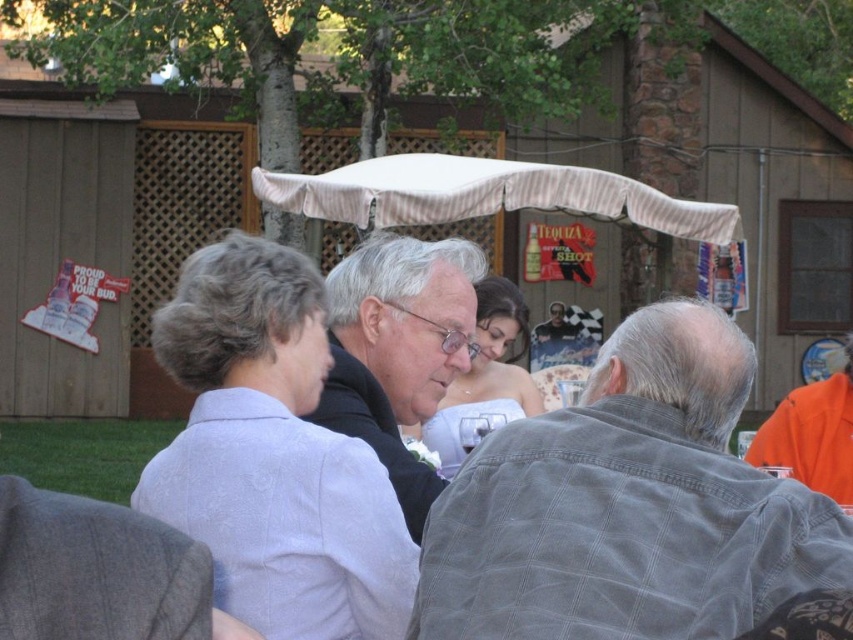
Can you confirm if gray corduroy jacket at center is positioned below light purple fabric shirt at upper left?

Actually, gray corduroy jacket at center is above light purple fabric shirt at upper left.

Is gray corduroy jacket at center above light purple fabric shirt at upper left?

Indeed, gray corduroy jacket at center is positioned over light purple fabric shirt at upper left.

Describe the element at coordinates (628, 506) in the screenshot. I see `gray corduroy jacket at center` at that location.

I want to click on gray corduroy jacket at center, so click(628, 506).

Which is above, gray corduroy jacket at center or matte white dress at center?

matte white dress at center is above.

Does point (682, 541) come farther from viewer compared to point (450, 387)?

No, (682, 541) is in front of (450, 387).

Locate an element on the screen. gray corduroy jacket at center is located at coordinates (628, 506).

Is gray corduroy jacket at center to the left of black textured suit at center from the viewer's perspective?

In fact, gray corduroy jacket at center is to the right of black textured suit at center.

Does gray corduroy jacket at center have a greater height compared to black textured suit at center?

No, gray corduroy jacket at center is not taller than black textured suit at center.

You are a GUI agent. You are given a task and a screenshot of the screen. Output one action in this format:
    pyautogui.click(x=<x>, y=<y>)
    Task: Click on the gray corduroy jacket at center
    The width and height of the screenshot is (853, 640).
    Given the screenshot: What is the action you would take?
    [628, 506]